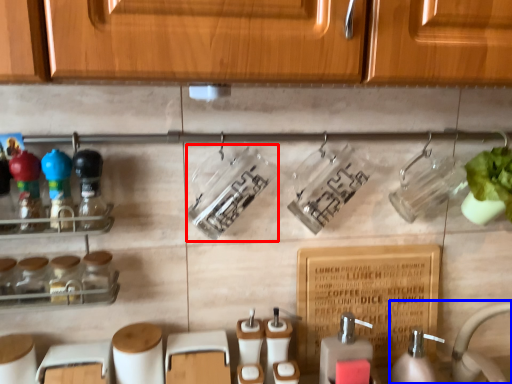
Question: Which point is further to the camera, bottle (highlighted by a red box) or sink (highlighted by a blue box)?

Choices:
 (A) bottle
 (B) sink

Answer: (A)